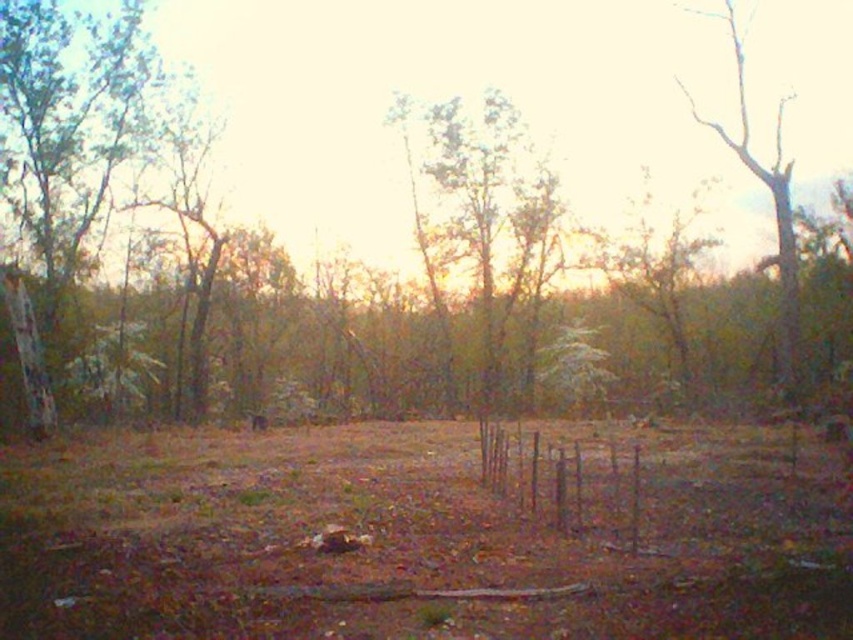
You are standing at the point marked as point (419,538) in the scene. What do you see directly beneath your feet?

You are standing on the brown dirt field at center located at point (419,538).

You are standing in the open area with dry grass and looking towards the fence. There is a brown wood tree at center and a green leafy tree at center. Which tree do you see taller?

The brown wood tree at center is taller than the green leafy tree at center.

You are standing at the edge of the brown dirt field at center and want to walk to the green leafy tree at left. Based on their sizes, which direction should you head towards?

The brown dirt field at center is wider than the green leafy tree at left, so you should head towards the left direction to reach the tree.